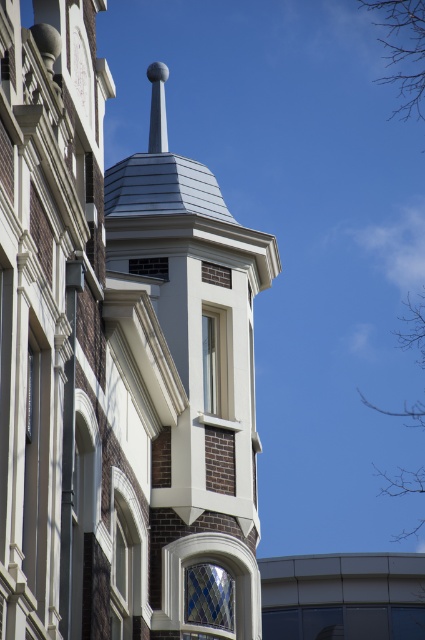
Question: Which of the following is the farthest from the observer?

Choices:
 (A) blue diamond-patterned glass at center
 (B) satin silver spire at upper center
 (C) matte gray window at upper center

Answer: (B)

Question: Is white glass window at center behind matte gray window at upper center?

Choices:
 (A) yes
 (B) no

Answer: (A)

Question: Which point is closer to the camera taking this photo?

Choices:
 (A) (141, 264)
 (B) (221, 344)

Answer: (A)

Question: Does white smooth tower at center appear on the right side of blue diamond-patterned glass at center?

Choices:
 (A) no
 (B) yes

Answer: (A)

Question: Which of these objects is positioned closest to the white glass window at center?

Choices:
 (A) blue diamond-patterned glass at center
 (B) white smooth tower at center
 (C) satin silver spire at upper center

Answer: (B)

Question: Is white smooth tower at center smaller than blue diamond-patterned glass at center?

Choices:
 (A) no
 (B) yes

Answer: (A)